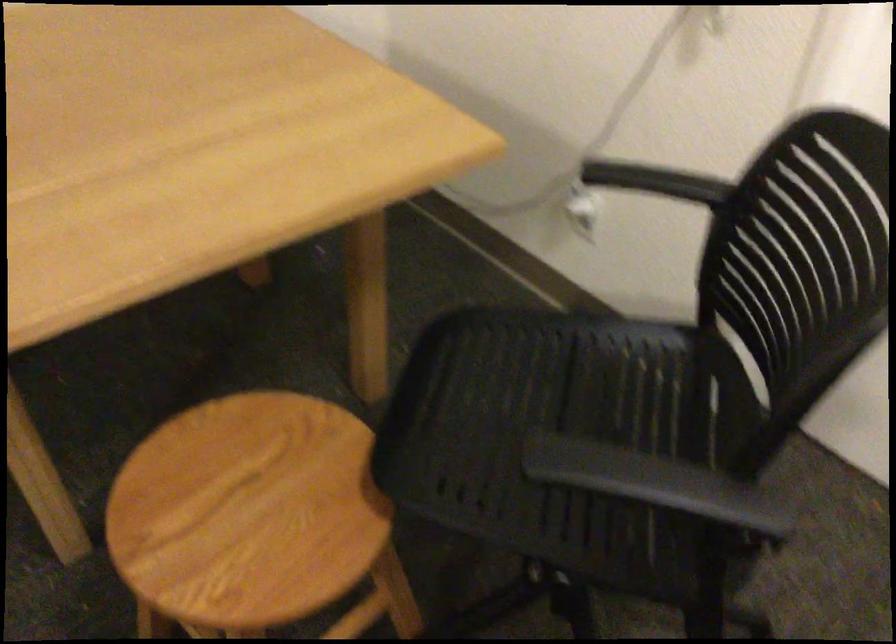
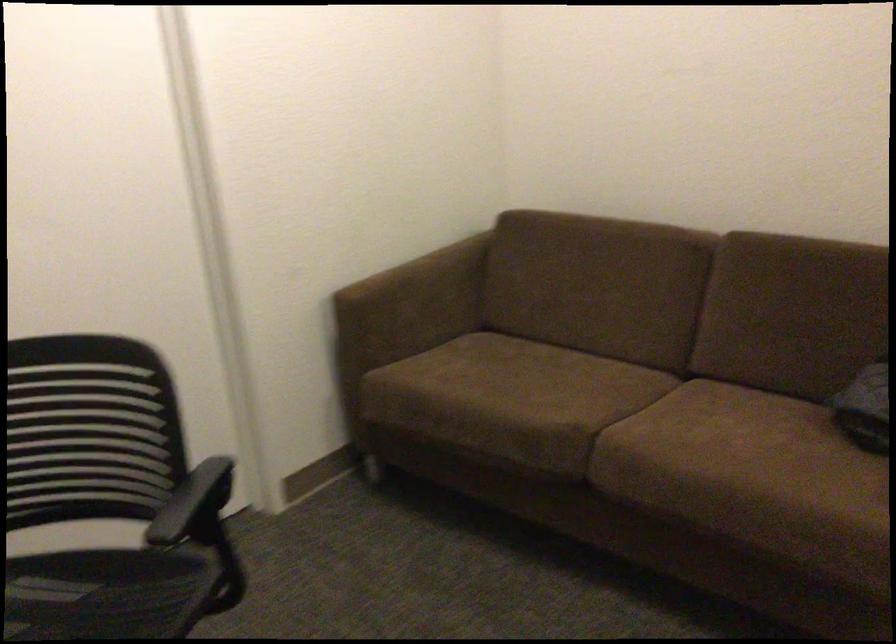
In the second image, find the point that corresponds to point 679,504 in the first image.

(192, 500)